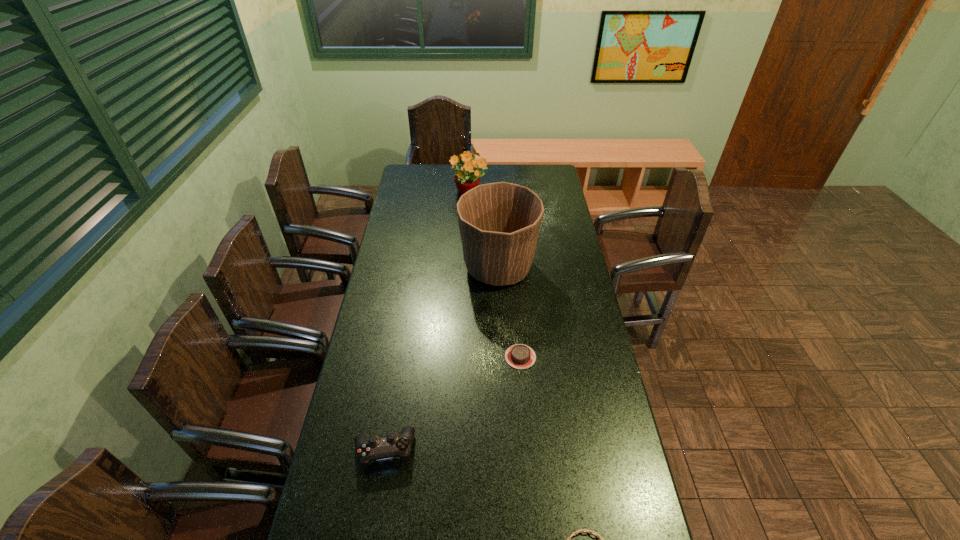
Find the location of `the second closest object to the bracelet`. the second closest object to the bracelet is located at coordinates (520, 356).

Select which object appears as the closest to the bracelet. Please provide its 2D coordinates. Your answer should be formatted as a tuple, i.e. [(x, y)], where the tuple contains the x and y coordinates of a point satisfying the conditions above.

[(374, 448)]

The height and width of the screenshot is (540, 960). I want to click on vacant point that satisfies the following two spatial constraints: 1. on the front side of the fourth nearest object; 2. on the left side of the chocolate cake, so click(502, 357).